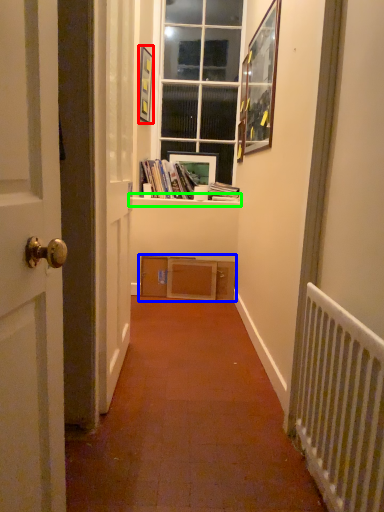
Question: Which object is the farthest from picture frame (highlighted by a red box)? Choose among these: shelf (highlighted by a blue box) or window sill (highlighted by a green box).

Choices:
 (A) shelf
 (B) window sill

Answer: (A)